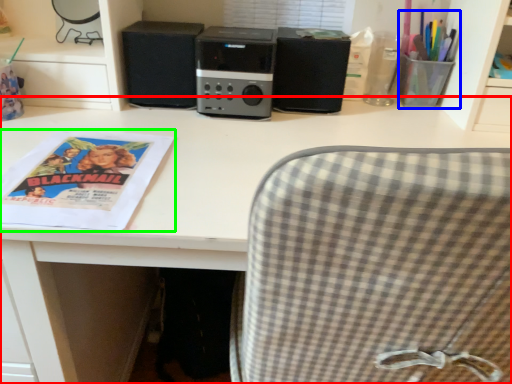
Question: Based on their relative distances, which object is farther from desk (highlighted by a red box)? Choose from stationery (highlighted by a blue box) and magazine (highlighted by a green box).

Choices:
 (A) stationery
 (B) magazine

Answer: (A)